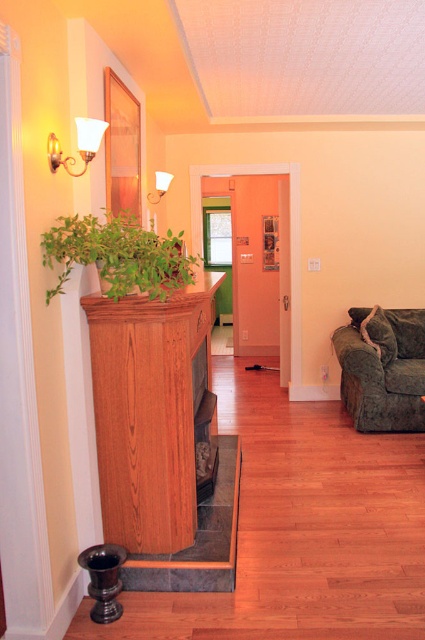
Can you confirm if velvet green couch at lower right is positioned to the right of velvety gray pillow at right?

Indeed, velvet green couch at lower right is positioned on the right side of velvety gray pillow at right.

Which is in front, point (368, 429) or point (384, 324)?

Positioned in front is point (368, 429).

You are a GUI agent. You are given a task and a screenshot of the screen. Output one action in this format:
    pyautogui.click(x=<x>, y=<y>)
    Task: Click on the velvet green couch at lower right
    Image resolution: width=425 pixels, height=640 pixels.
    Given the screenshot: What is the action you would take?
    pyautogui.click(x=382, y=369)

Between wooden fireplace at left and green leafy plant at left, which one has more height?

wooden fireplace at left

Which is behind, point (146, 440) or point (110, 248)?

The point (146, 440) is behind.

Between point (178, 588) and point (113, 250), which one is positioned behind?

Point (178, 588)

You are a GUI agent. You are given a task and a screenshot of the screen. Output one action in this format:
    pyautogui.click(x=<x>, y=<y>)
    Task: Click on the wooden fireplace at left
    The width and height of the screenshot is (425, 640).
    Given the screenshot: What is the action you would take?
    pyautogui.click(x=163, y=440)

Which of these two, velvet green couch at lower right or matte white wall sconce at upper left, stands taller?

velvet green couch at lower right is taller.

Does point (387, 364) lie in front of point (159, 172)?

No, (387, 364) is behind (159, 172).

Is point (382, 392) positioned behind point (167, 173)?

Yes, it is.

Where is `velvet green couch at lower right`? The image size is (425, 640). velvet green couch at lower right is located at coordinates (382, 369).